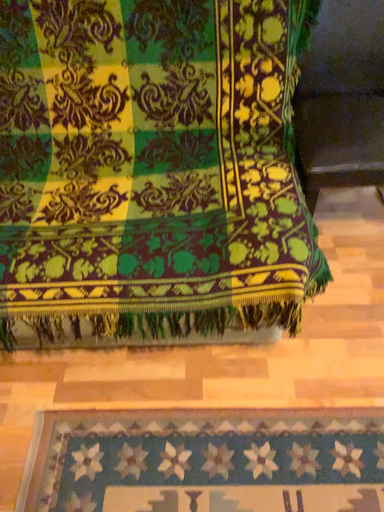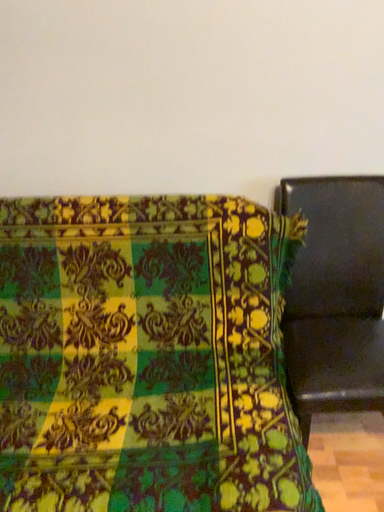
Question: Which way did the camera rotate in the video?

Choices:
 (A) rotated downward
 (B) rotated upward

Answer: (B)